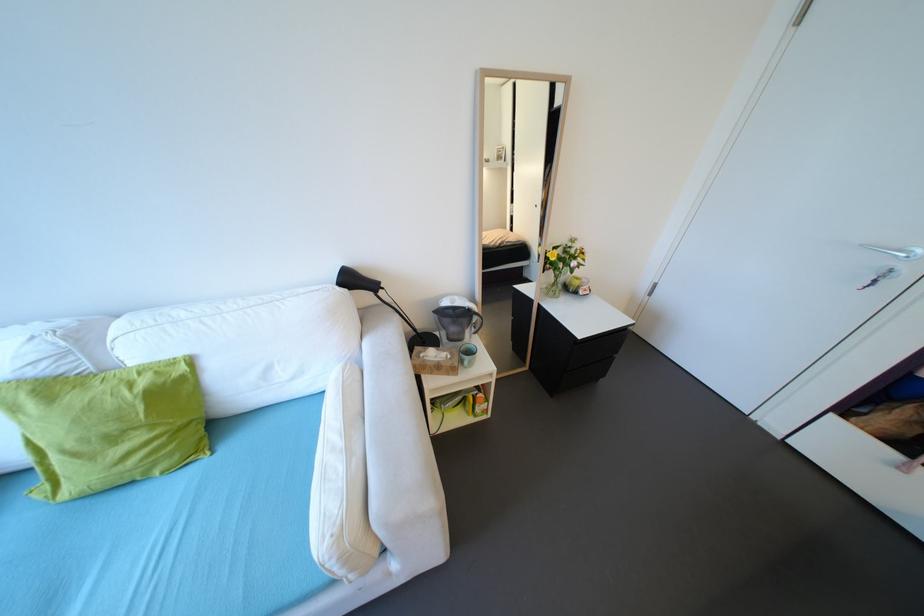
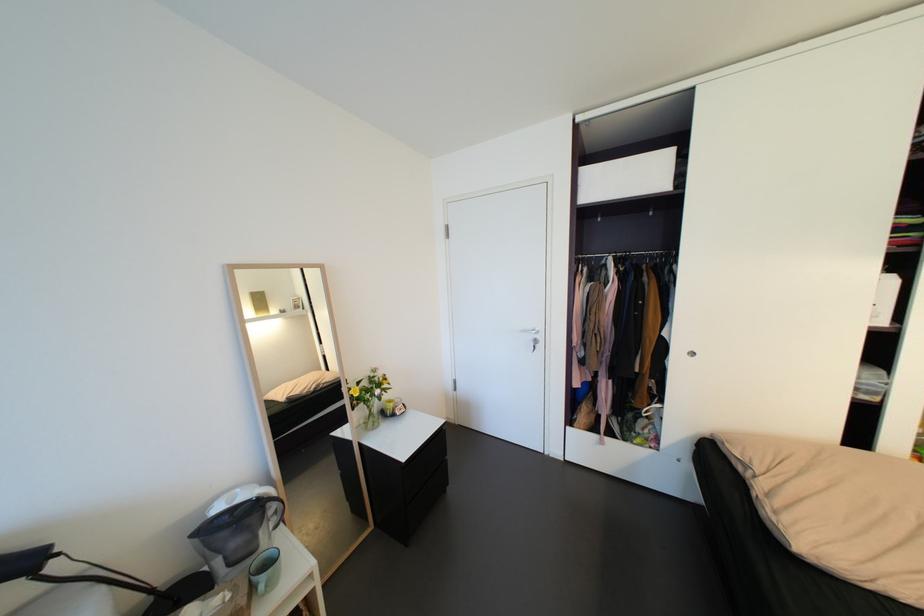
Locate, in the second image, the point that corresponds to (x=445, y=318) in the first image.

(210, 541)